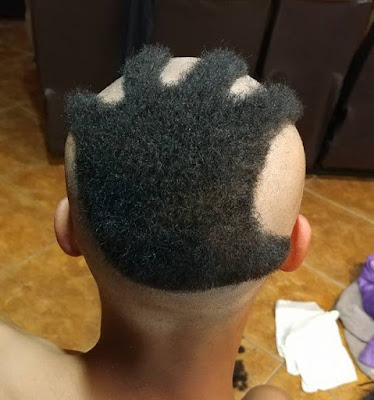
The width and height of the screenshot is (374, 400). In order to click on paper towels in this screenshot , I will do `click(313, 349)`, `click(287, 318)`.